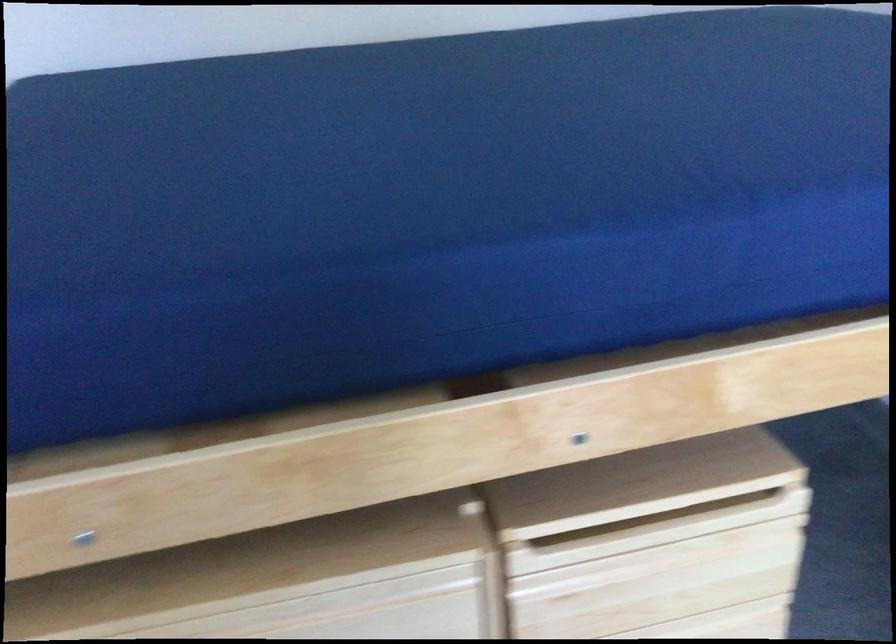
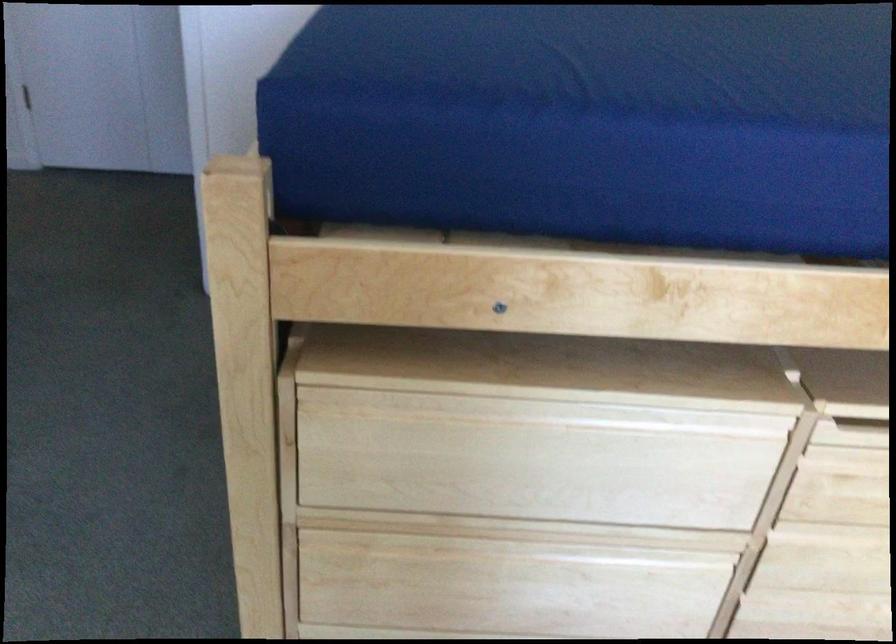
Question: The camera is either moving clockwise (left) or counter-clockwise (right) around the object. The first image is from the beginning of the video and the second image is from the end. Is the camera moving left or right when shooting the video?

Choices:
 (A) Left
 (B) Right

Answer: (B)